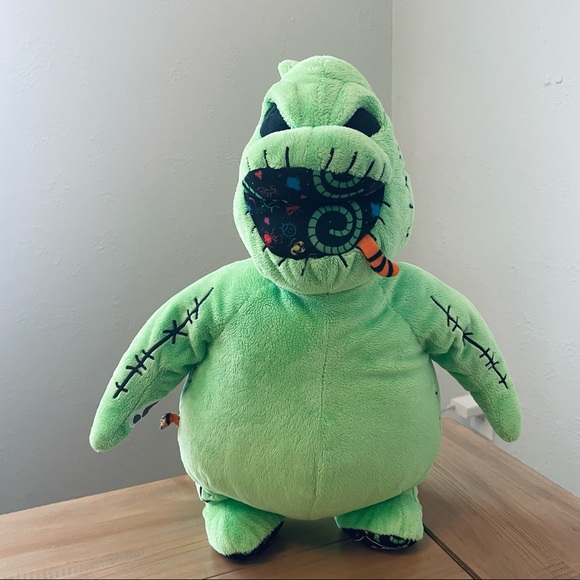
Identify the location of the right side table. The image size is (580, 580). (524, 539).